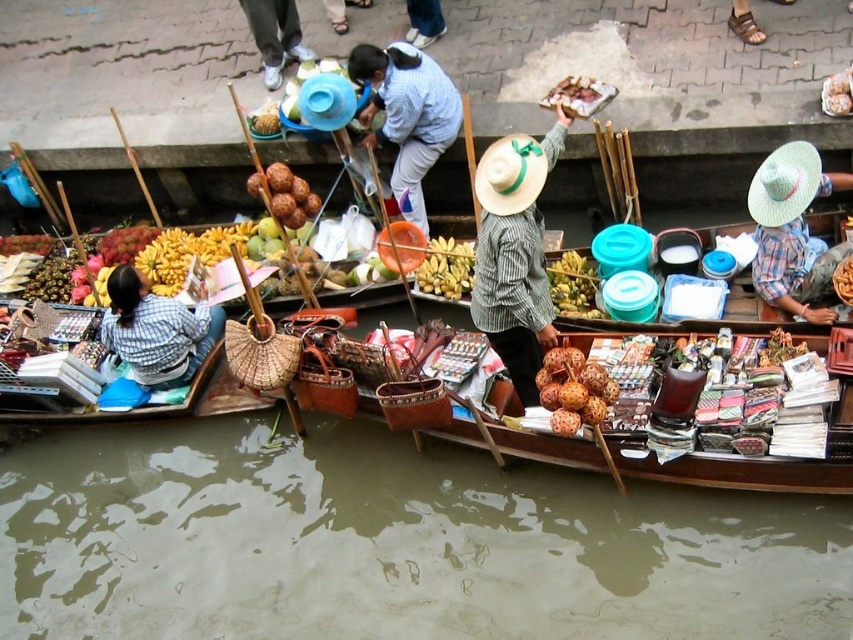
Question: Which of the following is the closest to the observer?

Choices:
 (A) yellow matte bananas at left
 (B) white fabric pants at upper center

Answer: (A)

Question: Which point appears closest to the camera in this image?

Choices:
 (A) (560, 257)
 (B) (386, 84)
 (C) (183, 262)

Answer: (B)

Question: Is brown murky water at lower center further to camera compared to yellow matte bananas at center?

Choices:
 (A) yes
 (B) no

Answer: (B)

Question: Does striped cotton shirt at center appear over white fabric pants at upper center?

Choices:
 (A) no
 (B) yes

Answer: (A)

Question: Is brown murky water at lower center below shiny plastic container at upper center?

Choices:
 (A) yes
 (B) no

Answer: (A)

Question: Which point is farther from the camera taking this photo?

Choices:
 (A) (595, 307)
 (B) (824, 312)
 (C) (577, 371)

Answer: (A)